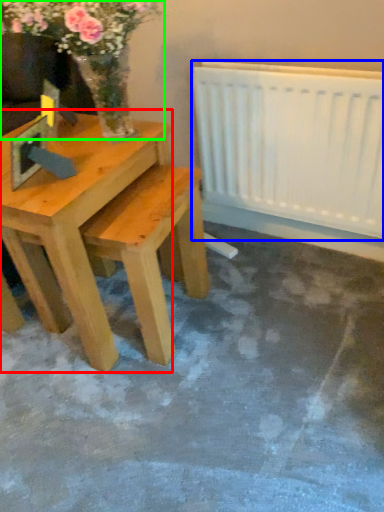
Question: Based on their relative distances, which object is nearer to table (highlighted by a red box)? Choose from radiator (highlighted by a blue box) and floral arrangement (highlighted by a green box).

Choices:
 (A) radiator
 (B) floral arrangement

Answer: (B)